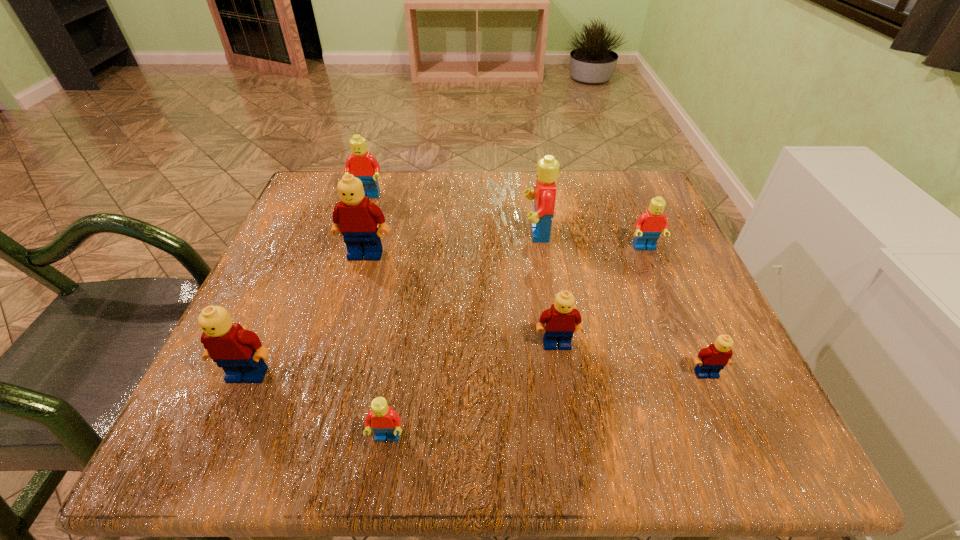
This screenshot has height=540, width=960. What are the coordinates of `free space between the rightmost red Lego and the leftmost red Lego` in the screenshot? It's located at (506, 222).

I want to click on vacant area that lies between the rightmost yellow Lego and the second smallest red Lego, so click(x=675, y=311).

Find the location of a particular element. The height and width of the screenshot is (540, 960). free space between the leftmost object and the smallest yellow Lego is located at coordinates (477, 374).

This screenshot has width=960, height=540. I want to click on empty space between the second smallest red Lego and the biggest red Lego, so click(x=590, y=241).

Identify the location of vacant area that lies between the biggest red Lego and the third yellow Lego from right to left. This screenshot has height=540, width=960. (451, 244).

Image resolution: width=960 pixels, height=540 pixels. Identify the location of empty space that is in between the rightmost red Lego and the nearest red Lego. (516, 343).

The height and width of the screenshot is (540, 960). Identify the location of vacant point located between the second biggest red Lego and the fifth farthest Lego. (462, 270).

This screenshot has height=540, width=960. In order to click on empty location between the third smallest red Lego and the fourth nearest Lego in this screenshot , I will do `click(462, 270)`.

Locate an element on the screen. empty location between the second yellow Lego from left to right and the third yellow Lego from left to right is located at coordinates (461, 299).

The width and height of the screenshot is (960, 540). Identify the location of unoccupied area between the third red Lego from left to right and the third biggest yellow Lego. (546, 288).